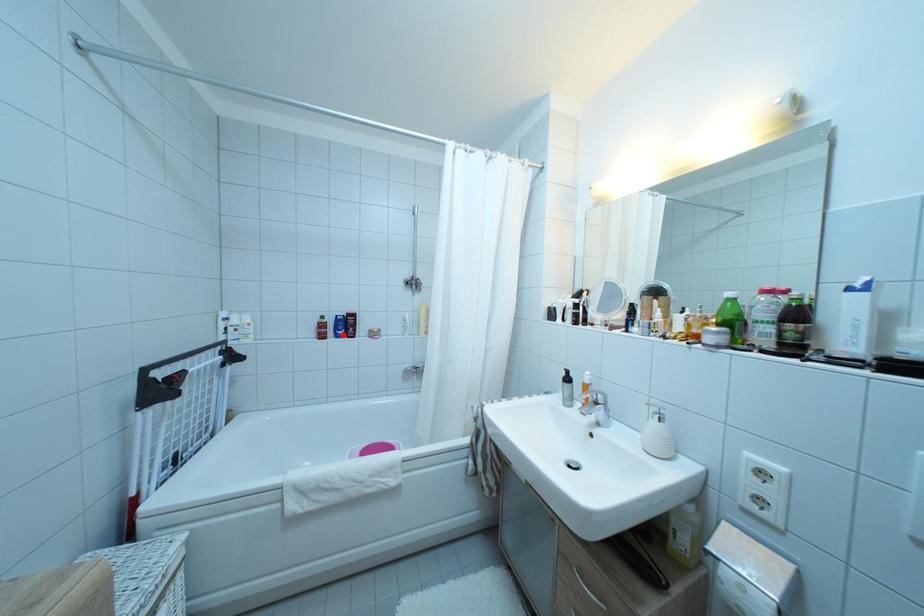
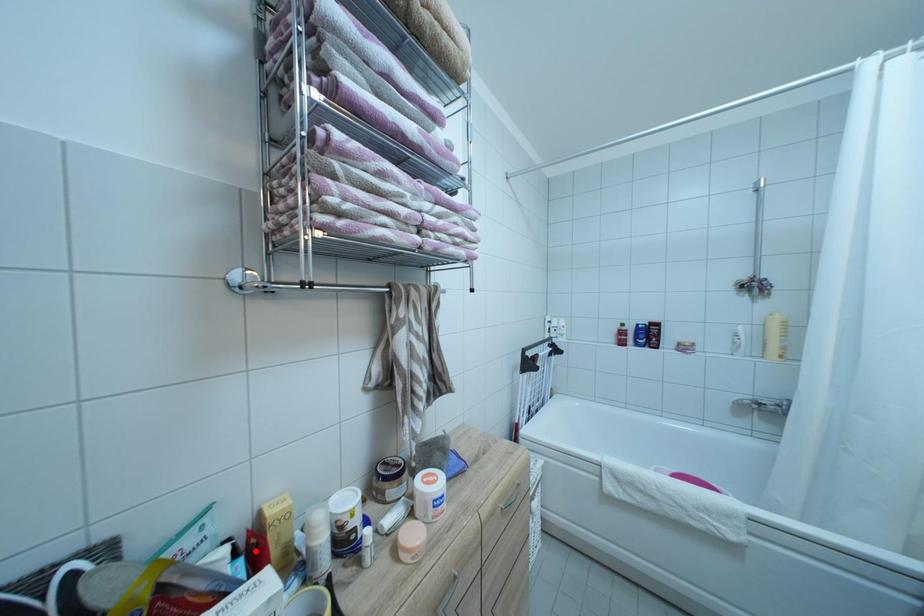
I am providing you with two images of the same scene from different viewpoints. A red point is marked on the first image and another point is marked on the second image. Are the points marked in image1 and image2 representing the same 3D position?

No